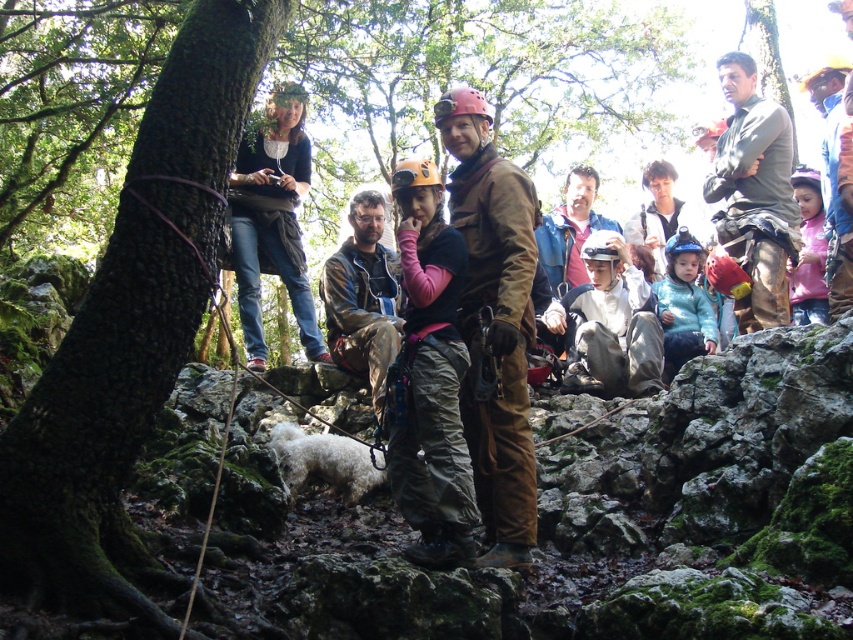
Question: Does camouflage pants at center have a greater width compared to matte brown helmet at center?

Choices:
 (A) yes
 (B) no

Answer: (B)

Question: Among these points, which one is nearest to the camera?

Choices:
 (A) (259, 356)
 (B) (354, 346)

Answer: (B)

Question: Is green rough bark tree at upper left to the right of brown suede jacket at center from the viewer's perspective?

Choices:
 (A) yes
 (B) no

Answer: (B)

Question: Among these points, which one is nearest to the camera?

Choices:
 (A) (341, 257)
 (B) (341, 474)

Answer: (B)

Question: Which object is closer to the camera taking this photo?

Choices:
 (A) white fluffy dog at center
 (B) green rough bark tree at upper left

Answer: (B)

Question: From the image, what is the correct spatial relationship of green rough bark tree at upper left in relation to camouflage jacket at center?

Choices:
 (A) below
 (B) above

Answer: (A)